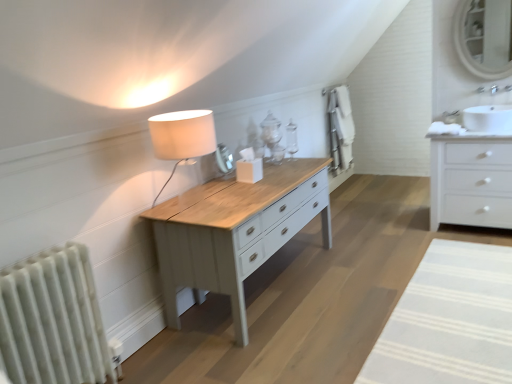
Question: From a real-world perspective, is matte white mirror at upper right positioned over white glossy chest of drawers at right based on gravity?

Choices:
 (A) no
 (B) yes

Answer: (B)

Question: Does matte white mirror at upper right have a larger size compared to white glossy chest of drawers at right?

Choices:
 (A) yes
 (B) no

Answer: (B)

Question: From the image's perspective, is matte white mirror at upper right below white glossy chest of drawers at right?

Choices:
 (A) no
 (B) yes

Answer: (A)

Question: Would you say matte white mirror at upper right is outside white glossy chest of drawers at right?

Choices:
 (A) yes
 (B) no

Answer: (A)

Question: Is matte white mirror at upper right positioned in front of white glossy chest of drawers at right?

Choices:
 (A) yes
 (B) no

Answer: (B)

Question: In the image, is matte white wood table lamp at center on the left side or the right side of white glossy sink at upper right?

Choices:
 (A) left
 (B) right

Answer: (A)

Question: In terms of size, does matte white wood table lamp at center appear bigger or smaller than white glossy sink at upper right?

Choices:
 (A) big
 (B) small

Answer: (A)

Question: From a real-world perspective, is matte white wood table lamp at center physically located above or below white glossy sink at upper right?

Choices:
 (A) above
 (B) below

Answer: (A)

Question: Considering the positions of point (176, 127) and point (493, 89), is point (176, 127) closer or farther from the camera than point (493, 89)?

Choices:
 (A) closer
 (B) farther

Answer: (A)

Question: From the image's perspective, is white glossy sink at upper right positioned above or below white textured radiator at left?

Choices:
 (A) below
 (B) above

Answer: (B)

Question: From a real-world perspective, is white glossy sink at upper right physically located above or below white textured radiator at left?

Choices:
 (A) below
 (B) above

Answer: (B)

Question: Considering the positions of point (484, 125) and point (104, 367), is point (484, 125) closer or farther from the camera than point (104, 367)?

Choices:
 (A) farther
 (B) closer

Answer: (A)

Question: Is white glossy sink at upper right in front of or behind white textured radiator at left in the image?

Choices:
 (A) behind
 (B) front

Answer: (A)

Question: Is point (456, 203) closer or farther from the camera than point (161, 225)?

Choices:
 (A) closer
 (B) farther

Answer: (B)

Question: Looking at the image, does white glossy chest of drawers at right seem bigger or smaller compared to matte white wooden table at center?

Choices:
 (A) big
 (B) small

Answer: (A)